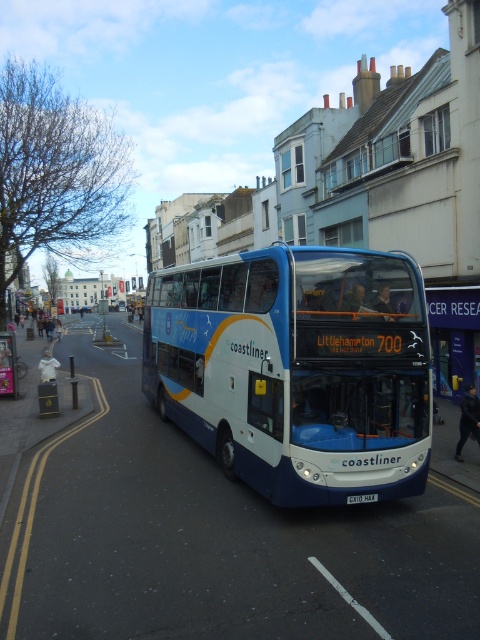
Question: Is blue metallic bus at center wider than white plastic license plate at center?

Choices:
 (A) no
 (B) yes

Answer: (A)

Question: Is blue metallic bus at center wider than white plastic license plate at center?

Choices:
 (A) no
 (B) yes

Answer: (A)

Question: Is blue metallic bus at center to the left of white plastic license plate at center from the viewer's perspective?

Choices:
 (A) yes
 (B) no

Answer: (A)

Question: Which point appears farthest from the camera in this image?

Choices:
 (A) (347, 400)
 (B) (355, 499)

Answer: (A)

Question: Among these objects, which one is farthest from the camera?

Choices:
 (A) white plastic license plate at center
 (B) blue metallic bus at center

Answer: (A)